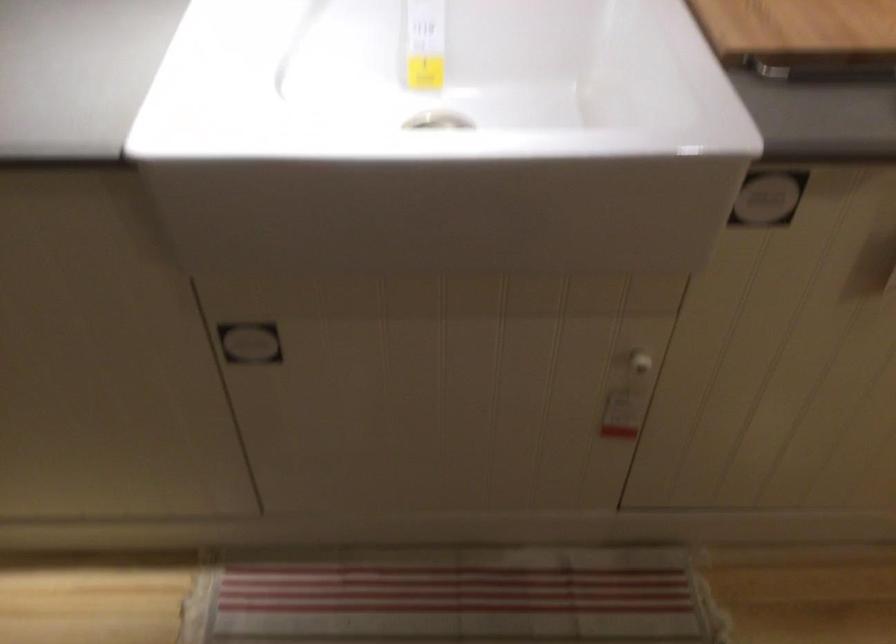
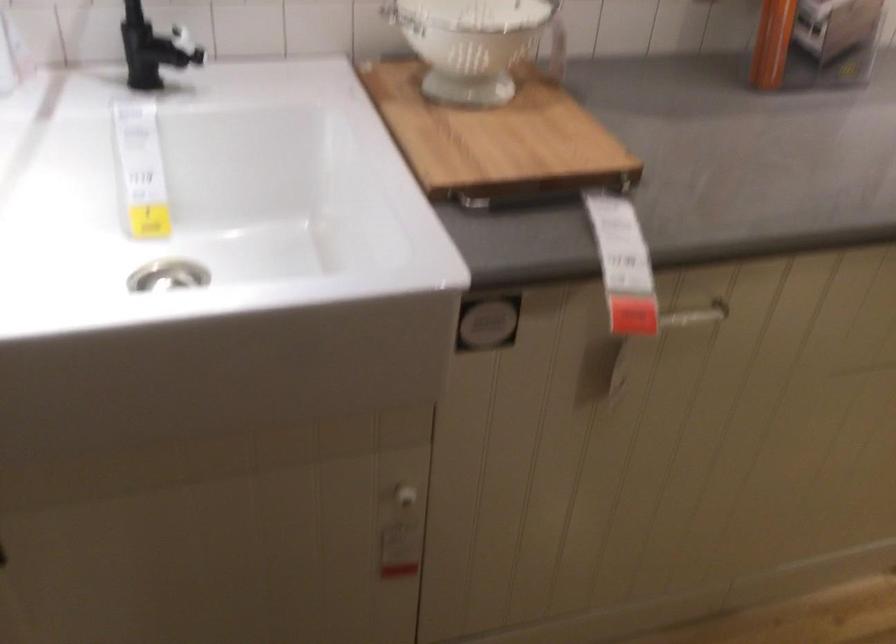
The point at (636, 366) is marked in the first image. Where is the corresponding point in the second image?

(403, 497)